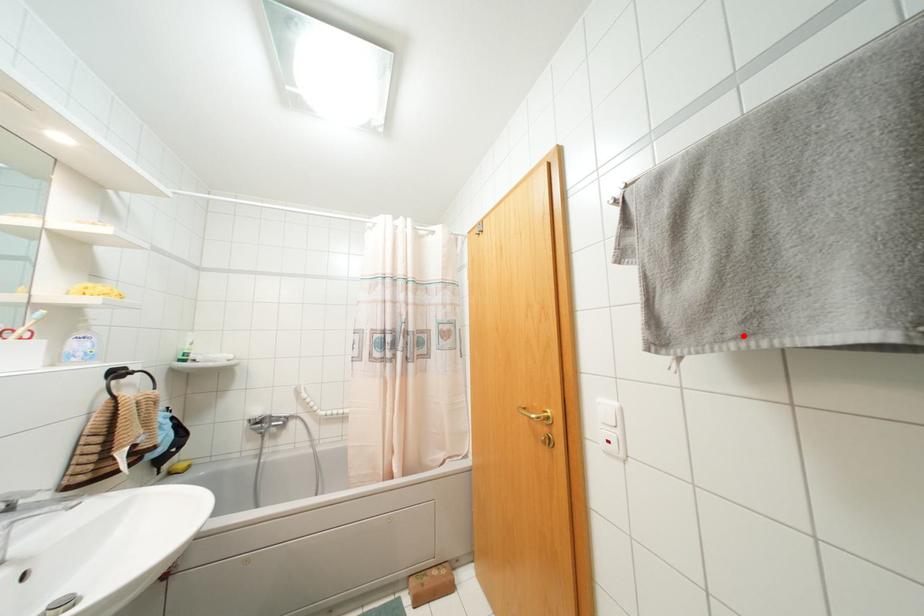
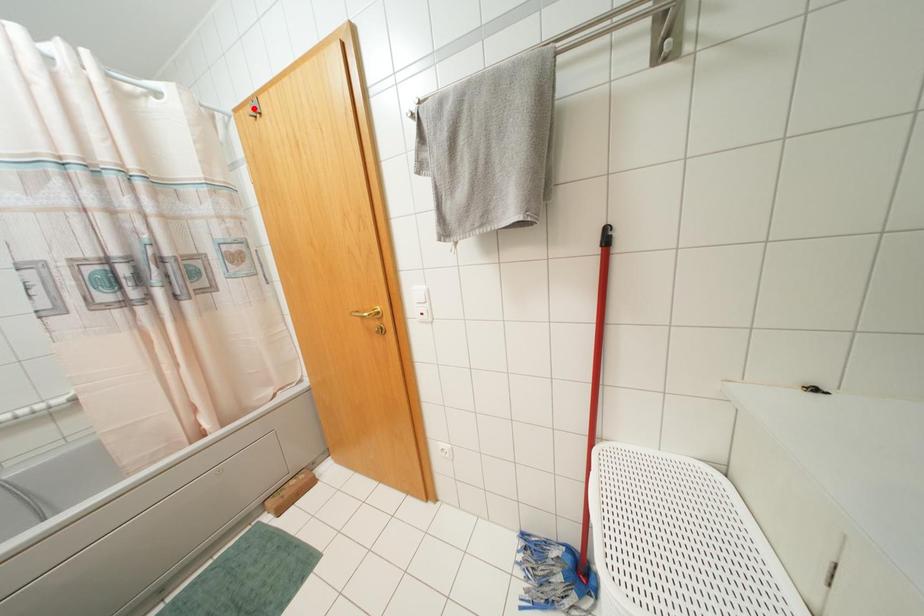
I am providing you with two images of the same scene from different viewpoints. A red point is marked on the first image and another point is marked on the second image. Is the marked point in image1 the same physical position as the marked point in image2?

No